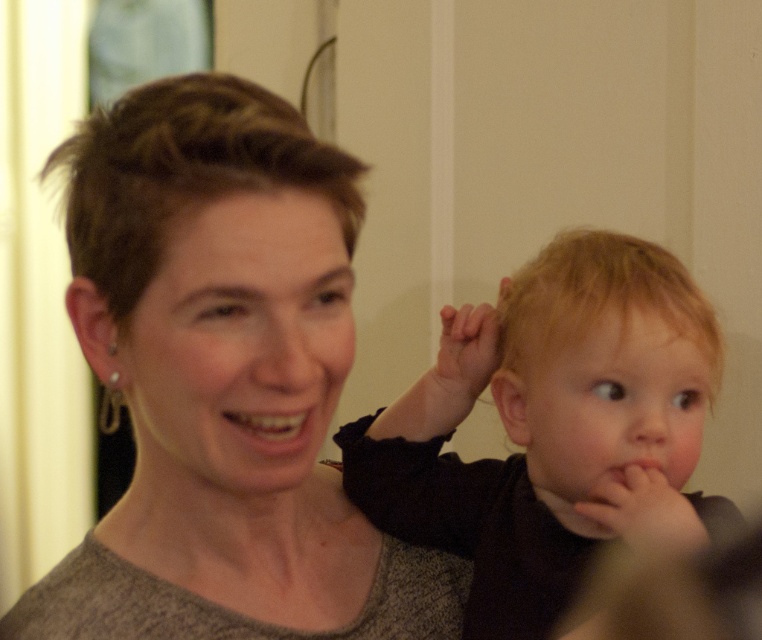
Question: Where is matte gray sweater at center located in relation to blonde hair at right in the image?

Choices:
 (A) below
 (B) above

Answer: (B)

Question: Which object appears closest to the camera in this image?

Choices:
 (A) matte gray sweater at center
 (B) blonde hair at right

Answer: (A)

Question: Where is matte gray sweater at center located in relation to blonde hair at right in the image?

Choices:
 (A) left
 (B) right

Answer: (A)

Question: Does matte gray sweater at center appear under blonde hair at right?

Choices:
 (A) no
 (B) yes

Answer: (A)

Question: Which of the following is the farthest from the observer?

Choices:
 (A) matte gray sweater at center
 (B) blonde hair at right

Answer: (B)